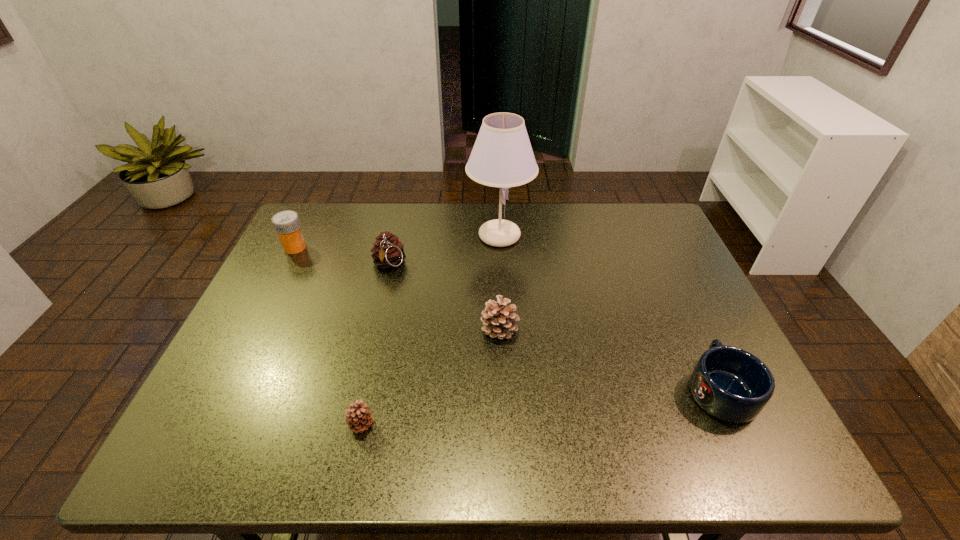
I want to click on the tallest object, so click(502, 156).

Where is `the leftmost object`? the leftmost object is located at coordinates (286, 223).

This screenshot has width=960, height=540. Find the location of `the farthest pinecone`. the farthest pinecone is located at coordinates (388, 251).

You are a GUI agent. You are given a task and a screenshot of the screen. Output one action in this format:
    pyautogui.click(x=<x>, y=<y>)
    Task: Click on the rightmost pinecone
    The height and width of the screenshot is (540, 960).
    Given the screenshot: What is the action you would take?
    pyautogui.click(x=498, y=319)

Identify the location of the second nearest pinecone. (498, 319).

Identify the location of the rightmost object. The height and width of the screenshot is (540, 960). (731, 384).

I want to click on the shortest pinecone, so click(x=358, y=418).

Where is `vacant space located on the left of the tallest object`? The image size is (960, 540). vacant space located on the left of the tallest object is located at coordinates (361, 235).

The height and width of the screenshot is (540, 960). I want to click on vacant space positioned 0.100m on the label side of the leftmost object, so click(x=340, y=247).

The width and height of the screenshot is (960, 540). Find the location of `free space located with a leaf charm attached to the farthest pinecone`. free space located with a leaf charm attached to the farthest pinecone is located at coordinates (372, 340).